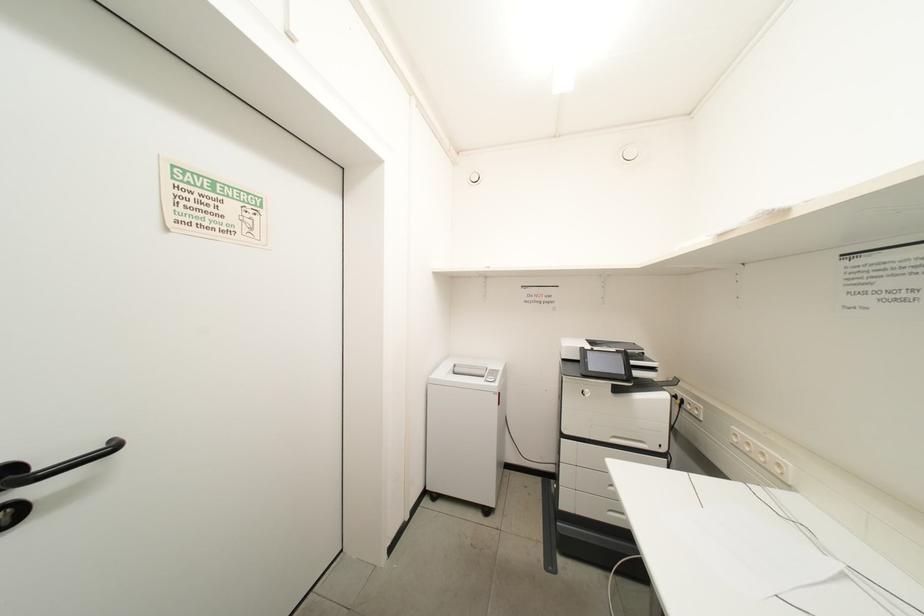
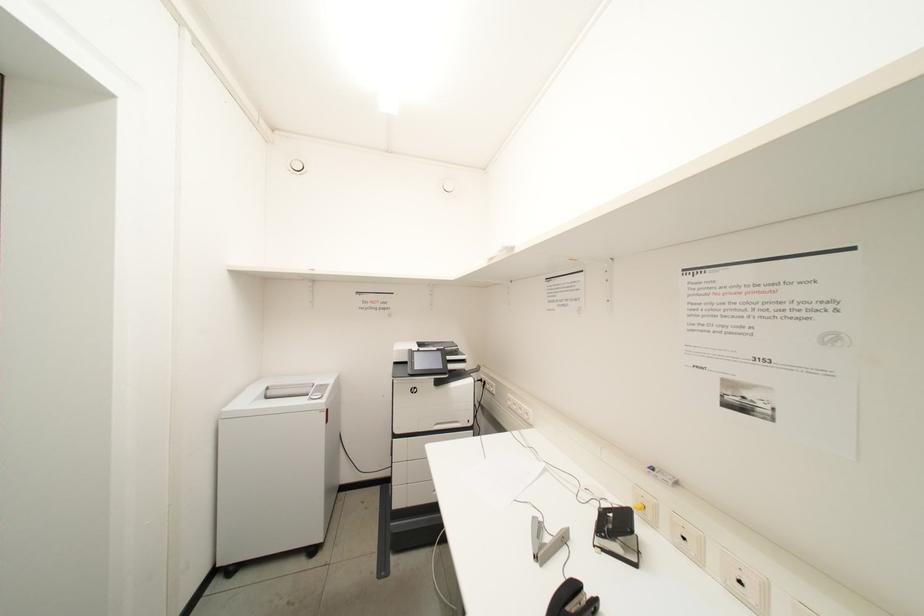
Question: The images are taken continuously from a first-person perspective. In which direction is your viewpoint rotating?

Choices:
 (A) Left
 (B) Right
 (C) Up
 (D) Down

Answer: (B)